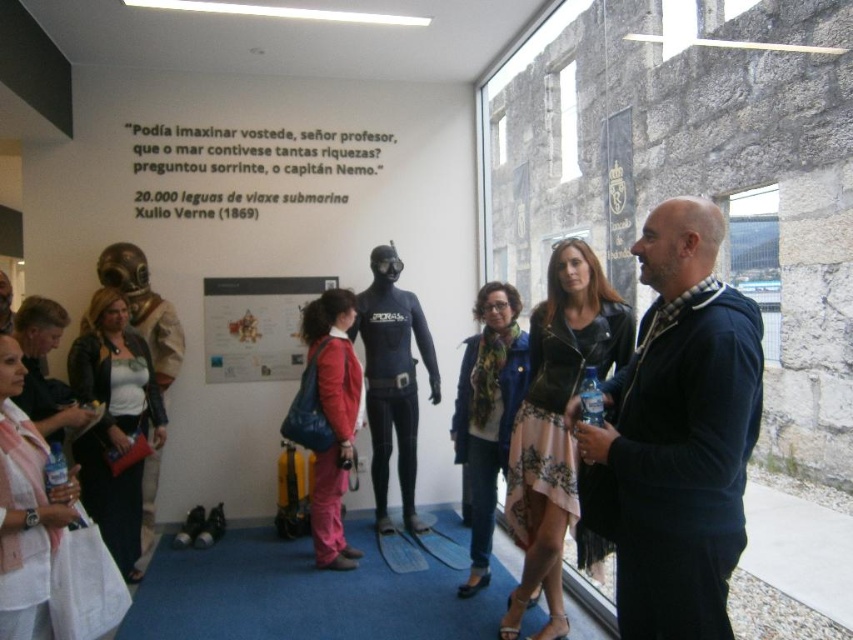
You are a fashion designer observing an exhibit and notice two coats displayed at the center of the room. The matte black jacket at center and the blue textured coat at center. Which one has a shorter length?

The matte black jacket at center is shorter than the blue textured coat at center.

You are an event organizer setting up a booth in the exhibit. You have two jackets displayed at the center of the booth. The leather jacket at center and the matte black jacket at center. You need to ensure that the wider jacket is placed on the left side of the booth for better visibility. Which jacket should you place on the left?

The leather jacket at center is wider than the matte black jacket at center, so you should place the leather jacket at center on the left side of the booth to ensure better visibility.

You are a visitor at this exhibit and notice two coats hanging on a rack in the center of the room. The matte black jacket at center and the blue textured coat at center. Which one is positioned higher on the rack?

The matte black jacket at center is positioned higher on the rack than the blue textured coat at center.